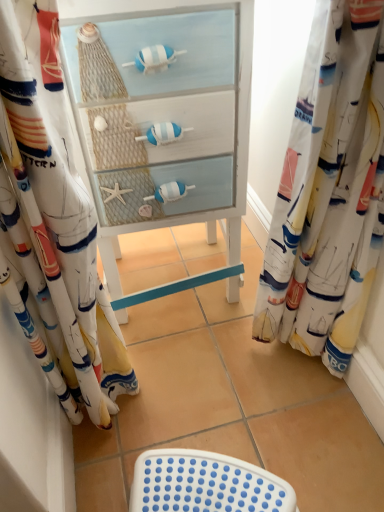
Question: Looking at their shapes, would you say white painted wood cabinet at center is wider or thinner than white plastic stool at lower center?

Choices:
 (A) wide
 (B) thin

Answer: (A)

Question: From a real-world perspective, is white painted wood cabinet at center above or below white plastic stool at lower center?

Choices:
 (A) below
 (B) above

Answer: (B)

Question: Estimate the real-world distances between objects in this image. Which object is closer to the white sailboat-patterned fabric at right, which appears as the first curtain when viewed from the right?

Choices:
 (A) white plastic stool at lower center
 (B) white painted wood cabinet at center
 (C) white sailboat-patterned fabric at left, which appears as the first curtain when viewed from the left

Answer: (B)

Question: Which object is positioned closest to the white sailboat-patterned fabric at right, which is the second curtain from left to right?

Choices:
 (A) white plastic stool at lower center
 (B) white painted wood cabinet at center
 (C) white sailboat-patterned fabric at left, which appears as the first curtain when viewed from the left

Answer: (B)